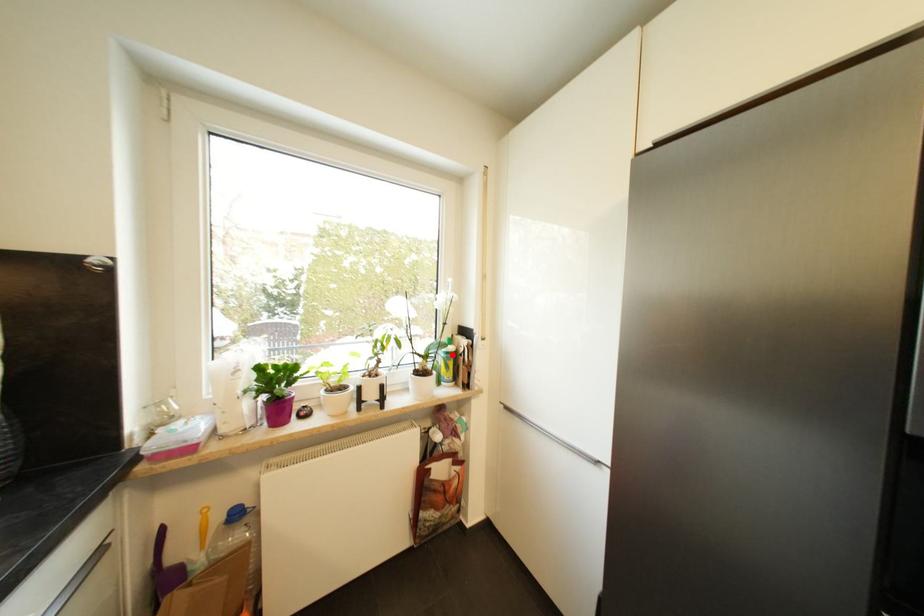
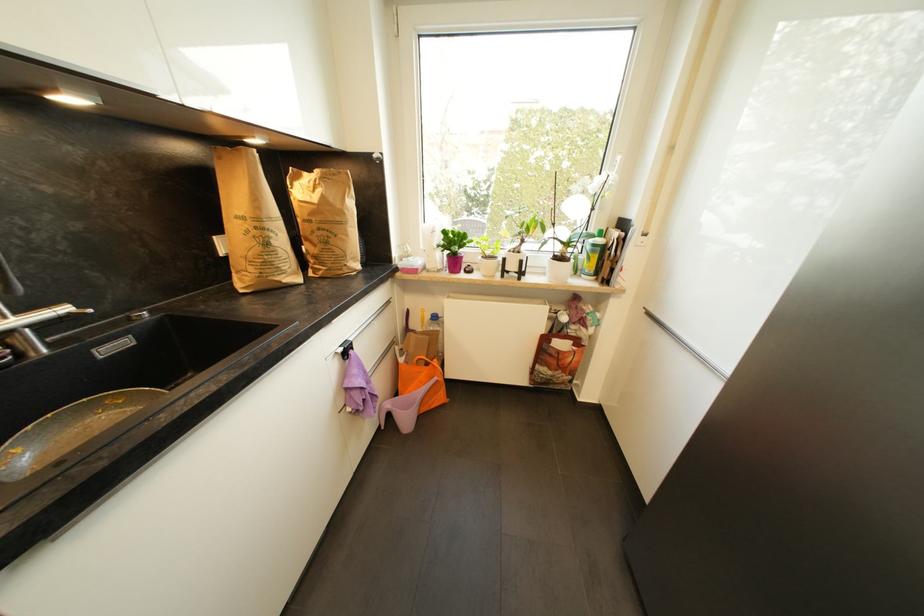
Find the pixel in the second image that matches the highlighted location in the first image.

(599, 246)